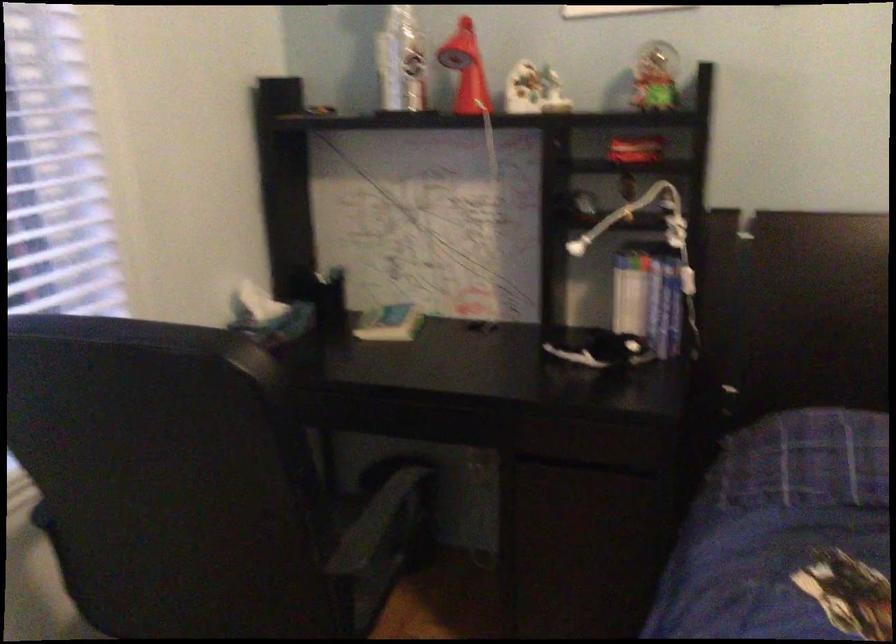
This screenshot has height=644, width=896. What do you see at coordinates (214, 560) in the screenshot? I see `a chair armrest` at bounding box center [214, 560].